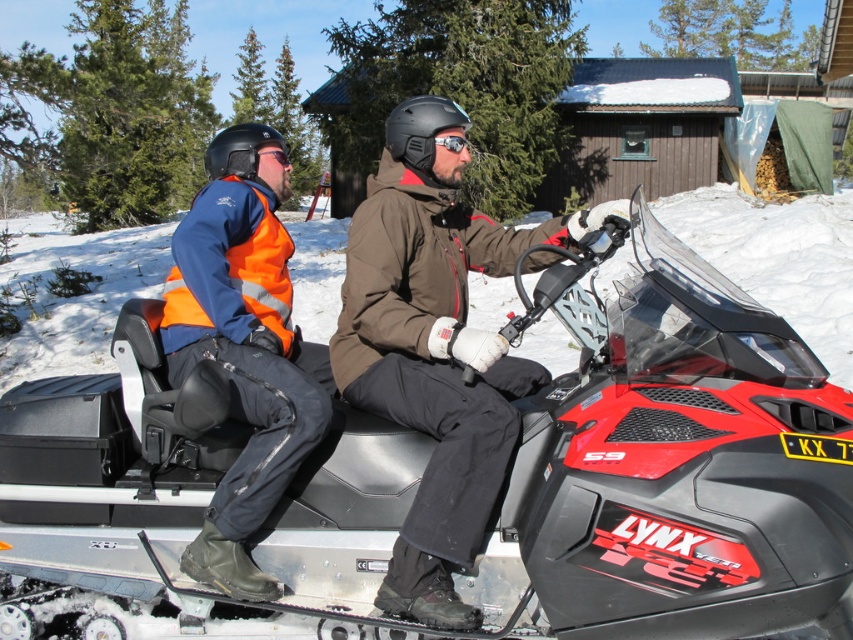
Can you confirm if matte black snowmobile at center is taller than matte black goggles at upper center?

Correct, matte black snowmobile at center is much taller as matte black goggles at upper center.

Does matte black snowmobile at center appear under matte black goggles at upper center?

Correct, matte black snowmobile at center is located below matte black goggles at upper center.

The image size is (853, 640). I want to click on matte black snowmobile at center, so click(x=428, y=348).

Locate an element on the screen. This screenshot has width=853, height=640. matte black snowmobile at center is located at coordinates (428, 348).

Measure the distance from matte black snowmobile at center to transparent plastic goggles at center.

matte black snowmobile at center is 34.65 inches away from transparent plastic goggles at center.

Which of these two, matte black snowmobile at center or transparent plastic goggles at center, stands taller?

matte black snowmobile at center is taller.

Identify the location of matte black snowmobile at center. This screenshot has height=640, width=853. (428, 348).

Which of these two, high visibility orange jacket at left or matte black goggles at upper center, stands shorter?

With less height is matte black goggles at upper center.

The height and width of the screenshot is (640, 853). Describe the element at coordinates (244, 348) in the screenshot. I see `high visibility orange jacket at left` at that location.

Locate an element on the screen. high visibility orange jacket at left is located at coordinates (x=244, y=348).